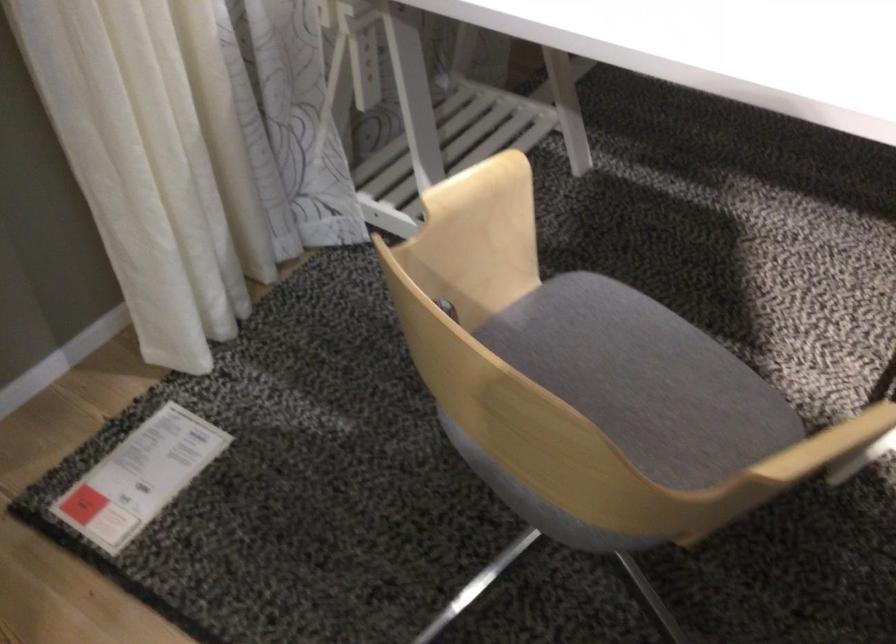
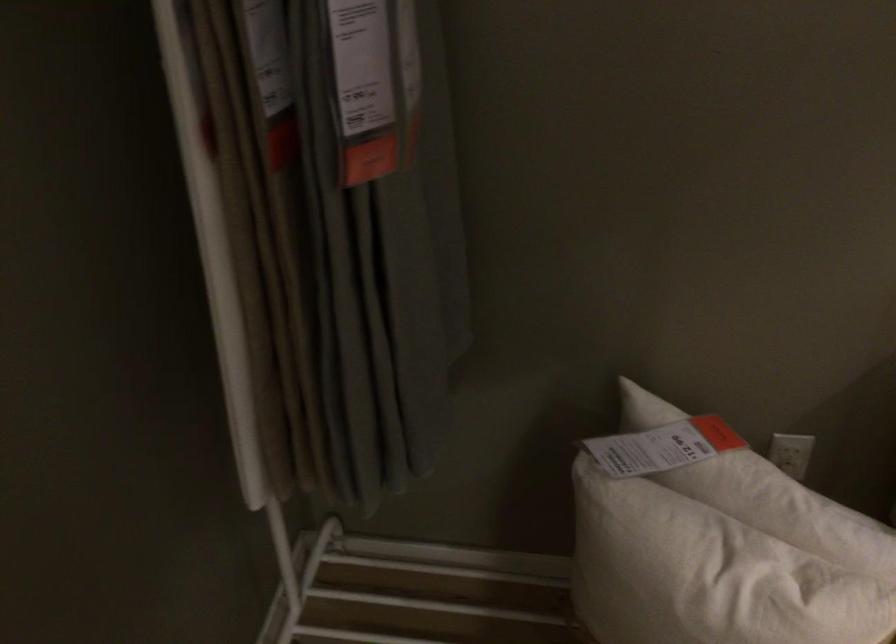
What movement of the cameraman would produce the second image?

The movement direction of the cameraman is right, forward.